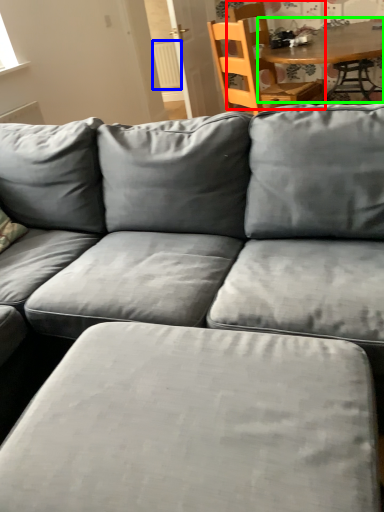
Question: Which object is the closest to the chair (highlighted by a red box)? Choose among these: radiator (highlighted by a blue box) or table (highlighted by a green box).

Choices:
 (A) radiator
 (B) table

Answer: (B)